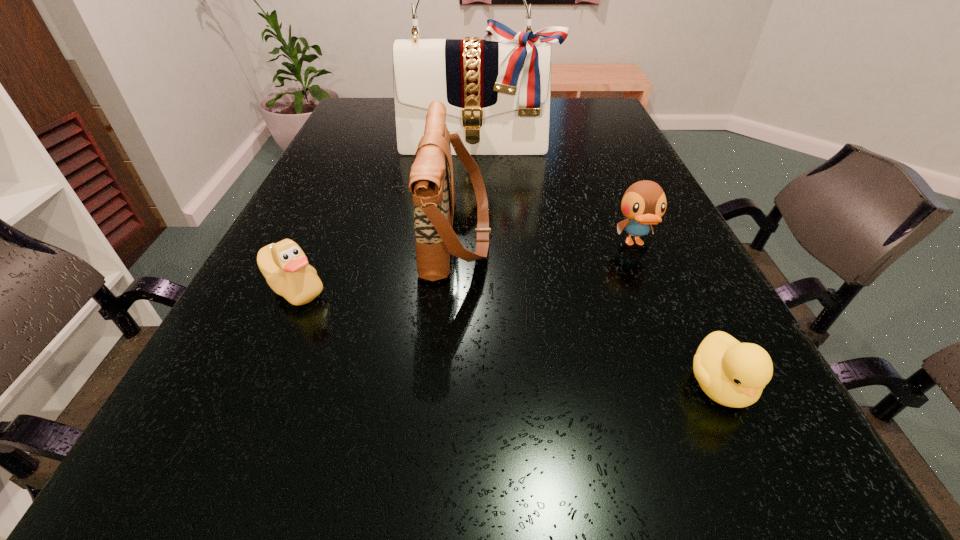
The image size is (960, 540). Identify the location of free space that satisfies the following two spatial constraints: 1. on the front-facing side of the tallest object; 2. on the front-facing side of the fourth shortest object. (477, 234).

Identify the location of free spot that satisfies the following two spatial constraints: 1. on the front-facing side of the farthest object; 2. on the front-facing side of the shoulder bag. (477, 234).

This screenshot has width=960, height=540. What are the coordinates of `free region that satisfies the following two spatial constraints: 1. on the front-facing side of the fourth shortest object; 2. at the beak of the leftmost duck` in the screenshot? It's located at (454, 288).

Locate an element on the screen. The width and height of the screenshot is (960, 540). free location that satisfies the following two spatial constraints: 1. on the front-facing side of the shoulder bag; 2. at the beak of the leftmost duck is located at coordinates (454, 288).